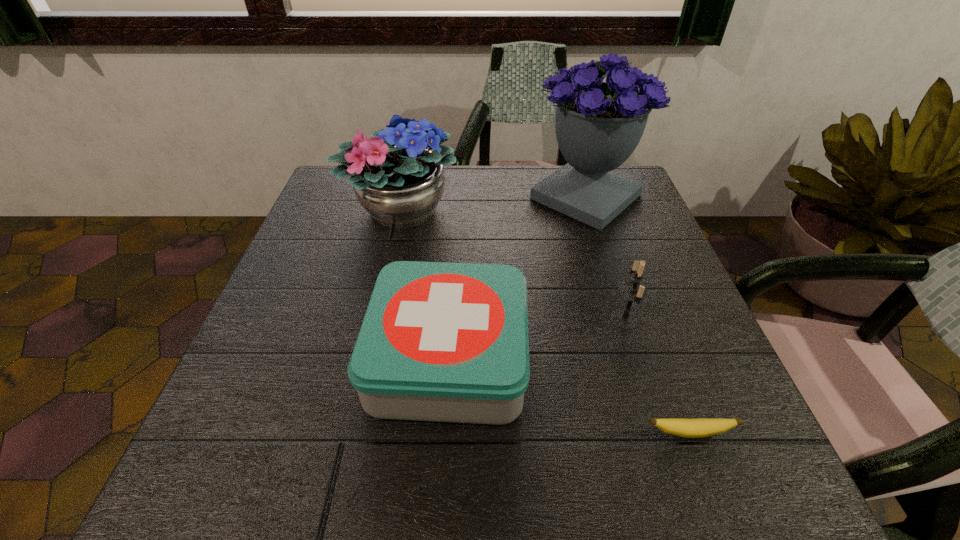
Locate an element on the screen. The image size is (960, 540). free location located on the right of the fourth tallest object is located at coordinates (695, 359).

I want to click on vacant space located 0.190m on the back of the shortest object, so click(651, 329).

I want to click on object that is at the left edge, so click(x=399, y=182).

You are a GUI agent. You are given a task and a screenshot of the screen. Output one action in this format:
    pyautogui.click(x=<x>, y=<y>)
    Task: Click on the bouquet that is positioned at the right edge
    
    Given the screenshot: What is the action you would take?
    pyautogui.click(x=598, y=125)

The image size is (960, 540). Identify the location of candle holder that is at the right edge. pos(633,292).

Where is `banana at the right edge`? The height and width of the screenshot is (540, 960). banana at the right edge is located at coordinates (701, 427).

Identify the location of object positioned at the far left corner. (399, 182).

Where is `object at the far right corner`? object at the far right corner is located at coordinates (598, 125).

You are a GUI agent. You are given a task and a screenshot of the screen. Output one action in this format:
    pyautogui.click(x=<x>, y=<y>)
    Task: Click on the free space at the far edge
    The width and height of the screenshot is (960, 540).
    Given the screenshot: What is the action you would take?
    pyautogui.click(x=548, y=167)

Image resolution: width=960 pixels, height=540 pixels. Identify the location of blank space at the near edge. (372, 451).